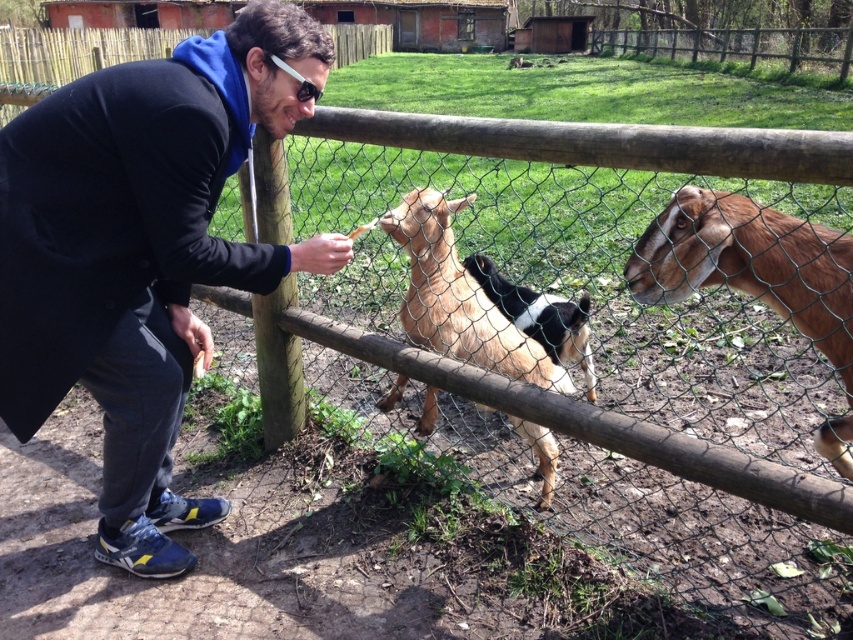
Question: Is wooden fence at upper center bigger than black and white fur goat at center?

Choices:
 (A) no
 (B) yes

Answer: (B)

Question: Which of the following is the farthest from the observer?

Choices:
 (A) (556, 323)
 (B) (283, 266)
 (C) (717, 202)

Answer: (A)

Question: Which point appears farthest from the camera in this image?

Choices:
 (A) (715, 209)
 (B) (582, 307)
 (C) (776, 45)
 (D) (549, 481)

Answer: (C)

Question: Can you confirm if wooden fence at upper center is positioned to the left of sunglasses at center?

Choices:
 (A) no
 (B) yes

Answer: (A)

Question: Which point is closer to the camera?

Choices:
 (A) black fabric jacket at left
 (B) wooden fence at upper center
 (C) brown matte goat at center
 (D) sunglasses at center

Answer: (C)

Question: Does black fabric jacket at left have a larger size compared to brown furry goat at center?

Choices:
 (A) yes
 (B) no

Answer: (A)